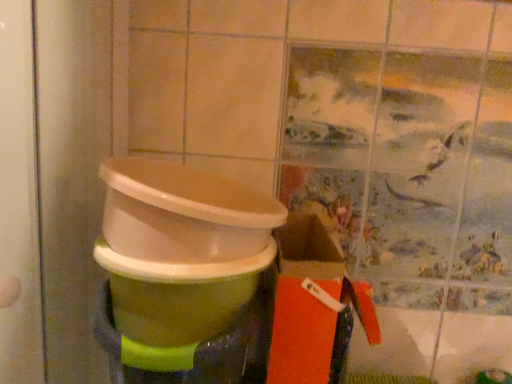
Image resolution: width=512 pixels, height=384 pixels. Describe the element at coordinates (185, 275) in the screenshot. I see `green glossy waste container at center` at that location.

Describe the element at coordinates (178, 296) in the screenshot. I see `green glossy toilet bowl at center` at that location.

At what (x,y) coordinates should I click in order to perform the action: click on green glossy waste container at center. Please return your answer as a coordinate pair (x, y). Looking at the image, I should click on (185, 275).

Based on the photo, is green glossy toilet bowl at center oriented towards orange matte box at lower right?

No.

From a real-world perspective, is green glossy toilet bowl at center over orange matte box at lower right?

No.

Considering the positions of objects green glossy toilet bowl at center and orange matte box at lower right in the image provided, who is more to the left, green glossy toilet bowl at center or orange matte box at lower right?

green glossy toilet bowl at center is more to the left.

From the image's perspective, does green glossy toilet bowl at center appear lower than orange matte box at lower right?

Yes.

How different are the orientations of orange matte box at lower right and green glossy toilet bowl at center in degrees?

They differ by 0.00105 degrees in their facing directions.

Which is correct: orange matte box at lower right is inside green glossy toilet bowl at center, or outside of it?

orange matte box at lower right is outside green glossy toilet bowl at center.

Measure the distance between orange matte box at lower right and green glossy toilet bowl at center.

orange matte box at lower right and green glossy toilet bowl at center are 6.07 inches apart.

Between point (277, 369) and point (120, 326), which one is positioned in front?

Point (120, 326)

Identify the location of box that is under the green glossy waste container at center (from a real-world perspective). (314, 306).

From a real-world perspective, is orange matte box at lower right physically below green glossy waste container at center?

Yes.

Is orange matte box at lower right closer to the viewer compared to green glossy waste container at center?

No, orange matte box at lower right is behind green glossy waste container at center.

Is orange matte box at lower right wider or thinner than green glossy waste container at center?

In the image, orange matte box at lower right appears to be more narrow than green glossy waste container at center.

Could you tell me if green glossy waste container at center is turned towards orange matte box at lower right?

No, green glossy waste container at center is not turned towards orange matte box at lower right.

Considering the sizes of objects green glossy waste container at center and orange matte box at lower right in the image provided, who is taller, green glossy waste container at center or orange matte box at lower right?

orange matte box at lower right.

How far apart are green glossy waste container at center and orange matte box at lower right?

They are 5.45 inches apart.

Considering the points (116, 272) and (328, 339), which point is in front, point (116, 272) or point (328, 339)?

The point (116, 272) is closer to the camera.

From the image's perspective, which one is positioned lower, green glossy waste container at center or green glossy toilet bowl at center?

From the image's view, green glossy toilet bowl at center is below.

Does green glossy waste container at center have a lesser width compared to green glossy toilet bowl at center?

Correct, the width of green glossy waste container at center is less than that of green glossy toilet bowl at center.

Does green glossy waste container at center come behind green glossy toilet bowl at center?

No, it is in front of green glossy toilet bowl at center.

From the image's perspective, is green glossy toilet bowl at center on green glossy waste container at center?

No, from the image's perspective, green glossy toilet bowl at center is not over green glossy waste container at center.

Which of these two, green glossy toilet bowl at center or green glossy waste container at center, stands taller?

green glossy toilet bowl at center.

From a real-world perspective, between green glossy toilet bowl at center and green glossy waste container at center, who is vertically lower?

In real-world perspective, green glossy toilet bowl at center is lower.

This screenshot has width=512, height=384. Find the location of `toilet bowl below the green glossy waste container at center (from the image's perspective)`. toilet bowl below the green glossy waste container at center (from the image's perspective) is located at coordinates (178, 296).

Find the location of `box behind the green glossy toilet bowl at center`. box behind the green glossy toilet bowl at center is located at coordinates (314, 306).

Where is `toilet bowl that is below the orange matte box at lower right (from the image's perspective)`? Image resolution: width=512 pixels, height=384 pixels. toilet bowl that is below the orange matte box at lower right (from the image's perspective) is located at coordinates (178, 296).

In the scene shown: Considering their positions, is green glossy toilet bowl at center positioned further to green glossy waste container at center than orange matte box at lower right?

orange matte box at lower right lies further to green glossy waste container at center than the other object.

When comparing their distances from green glossy waste container at center, does orange matte box at lower right or green glossy toilet bowl at center seem closer?

Result: green glossy toilet bowl at center is closer to green glossy waste container at center.

Looking at the image, which one is located further to orange matte box at lower right, green glossy waste container at center or green glossy toilet bowl at center?

green glossy toilet bowl at center is positioned further to the anchor orange matte box at lower right.

Based on their spatial positions, is green glossy toilet bowl at center or green glossy waste container at center closer to orange matte box at lower right?

green glossy waste container at center is closer to orange matte box at lower right.

When comparing their distances from green glossy toilet bowl at center, does green glossy waste container at center or orange matte box at lower right seem closer?

green glossy waste container at center lies closer to green glossy toilet bowl at center than the other object.

Estimate the real-world distances between objects in this image. Which object is further from green glossy toilet bowl at center, orange matte box at lower right or green glossy waste container at center?

orange matte box at lower right.

Where is `box that lies between green glossy waste container at center and green glossy toilet bowl at center from top to bottom`? Image resolution: width=512 pixels, height=384 pixels. box that lies between green glossy waste container at center and green glossy toilet bowl at center from top to bottom is located at coordinates (314, 306).